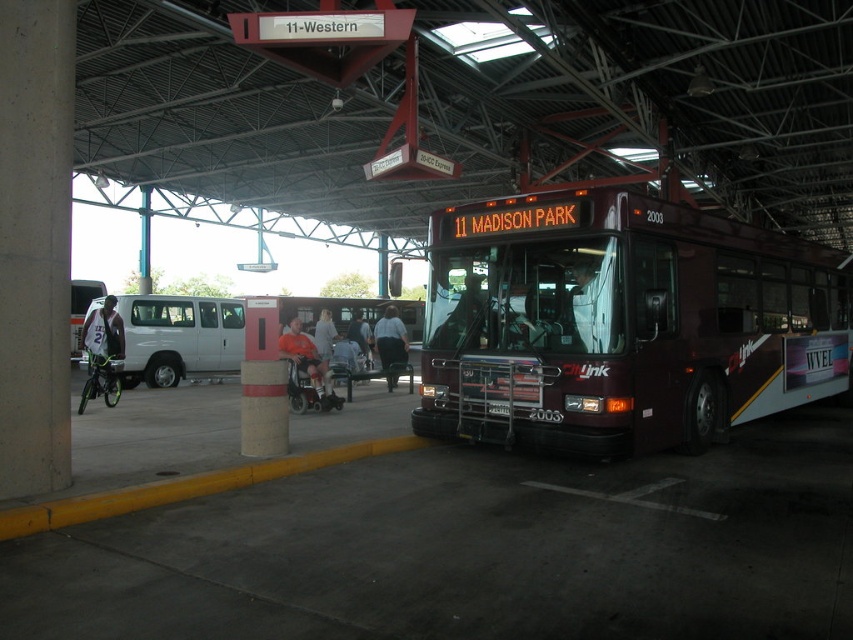
Question: Which of the following is the closest to the observer?

Choices:
 (A) (451, 232)
 (B) (572, 304)
 (C) (395, 374)

Answer: (B)

Question: Which point appears closest to the camera in this image?

Choices:
 (A) (817, 360)
 (B) (86, 300)
 (C) (305, 371)

Answer: (C)

Question: Can you confirm if green metallic bicycle at left is thinner than orange fabric wheelchair at center?

Choices:
 (A) yes
 (B) no

Answer: (A)

Question: Considering the real-world distances, which object is farthest from the white matte van at left?

Choices:
 (A) orange shirt at center
 (B) orange fabric wheelchair at center

Answer: (B)

Question: Can you confirm if orange fabric wheelchair at center is thinner than orange shirt at center?

Choices:
 (A) yes
 (B) no

Answer: (B)

Question: Does green metallic bicycle at left have a lesser width compared to dark gray jacket at center?

Choices:
 (A) no
 (B) yes

Answer: (B)